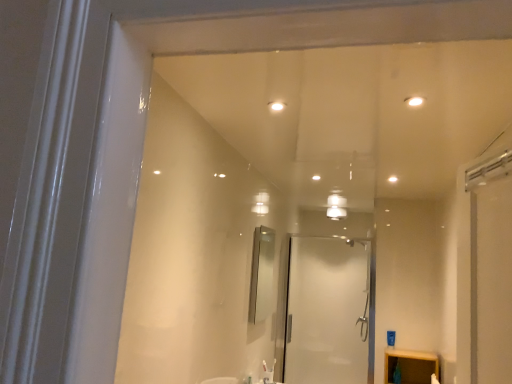
Question: Visually, is silver metallic mirror at center positioned to the left or to the right of transparent glass shower door at center?

Choices:
 (A) left
 (B) right

Answer: (A)

Question: From a real-world perspective, is silver metallic mirror at center above or below transparent glass shower door at center?

Choices:
 (A) above
 (B) below

Answer: (A)

Question: Is silver metallic mirror at center bigger or smaller than transparent glass shower door at center?

Choices:
 (A) small
 (B) big

Answer: (A)

Question: Is point (352, 281) positioned closer to the camera than point (254, 283)?

Choices:
 (A) farther
 (B) closer

Answer: (A)

Question: Is transparent glass shower door at center wider or thinner than silver metallic mirror at center?

Choices:
 (A) wide
 (B) thin

Answer: (A)

Question: Is transparent glass shower door at center situated inside silver metallic mirror at center or outside?

Choices:
 (A) outside
 (B) inside

Answer: (A)

Question: In the image, is transparent glass shower door at center on the left side or the right side of silver metallic mirror at center?

Choices:
 (A) right
 (B) left

Answer: (A)